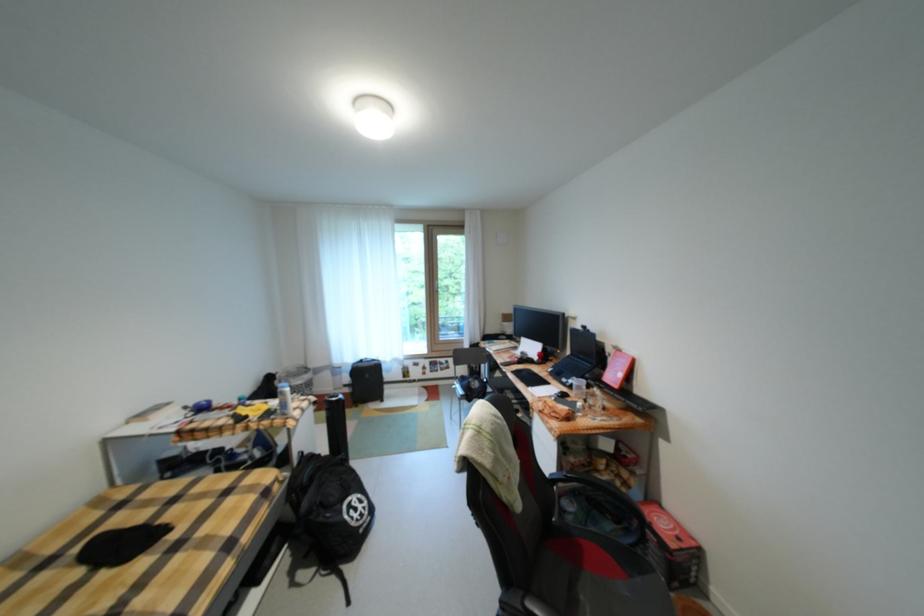
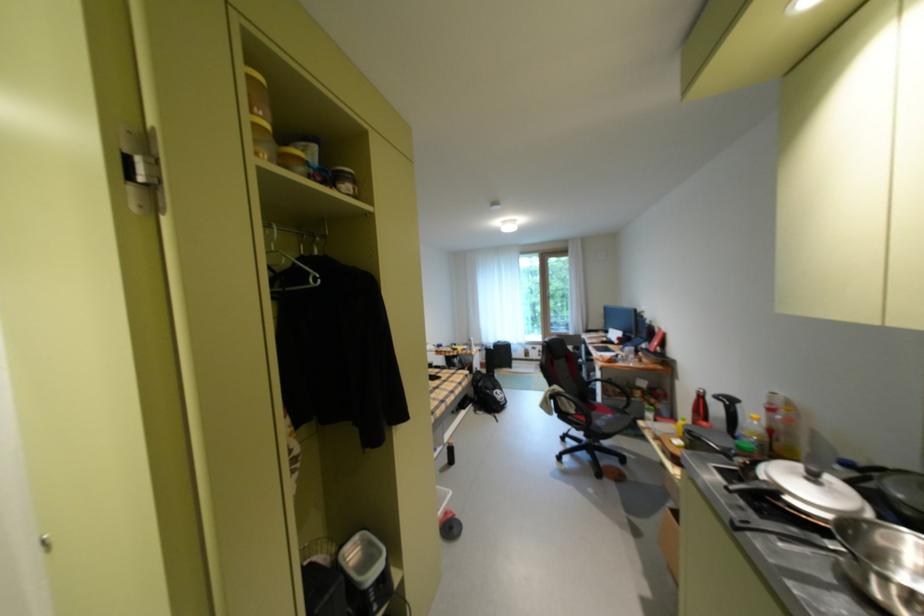
Locate, in the second image, the point that corresponds to (x=304, y=496) in the first image.

(484, 384)